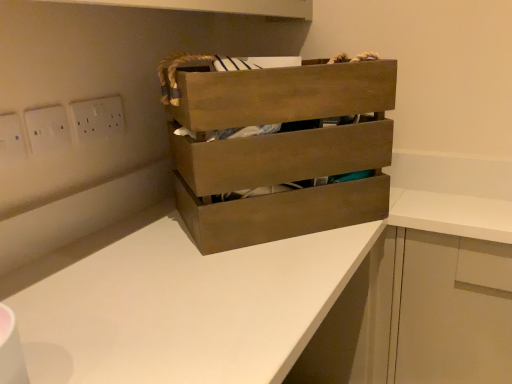
What do you see at coordinates (450, 293) in the screenshot? I see `white matte cabinet at lower right` at bounding box center [450, 293].

This screenshot has height=384, width=512. Describe the element at coordinates (97, 118) in the screenshot. I see `white plastic electric outlet at upper left, which ranks as the third electric outlet in front-to-back order` at that location.

Locate an element on the screen. Image resolution: width=512 pixels, height=384 pixels. white plastic switch at upper left, which appears as the second electric outlet when viewed from the front is located at coordinates (47, 129).

Find the location of a particular element. The height and width of the screenshot is (384, 512). electric outlet that is the 2nd one when counting upward from the white matte cabinet at lower right (from the image's perspective) is located at coordinates (47, 129).

Which object is positioned more to the right, white matte cabinet at lower right or white plastic switch at upper left, the 2th electric outlet in the left-to-right sequence?

white matte cabinet at lower right.

From the image's perspective, who appears lower, white matte cabinet at lower right or white plastic switch at upper left, the 2th electric outlet in the left-to-right sequence?

white matte cabinet at lower right is shown below in the image.

From a real-world perspective, is white matte cabinet at lower right physically below white plastic switch at upper left, the 2th electric outlet in the left-to-right sequence?

Yes.

Who is smaller, white matte counter at center or white matte cabinet at lower right?

white matte cabinet at lower right is smaller.

Looking at their sizes, would you say white matte counter at center is wider or thinner than white matte cabinet at lower right?

white matte counter at center is wider than white matte cabinet at lower right.

Is white matte counter at center oriented away from white matte cabinet at lower right?

No, white matte cabinet at lower right is not at the back of white matte counter at center.

From a real-world perspective, between white matte counter at center and white matte cabinet at lower right, who is vertically higher?

From a 3D spatial view, white matte cabinet at lower right is above.

Can you see white matte counter at center touching white plastic electric outlet at upper left, the first electric outlet in the front-to-back sequence?

No, white matte counter at center is not beside white plastic electric outlet at upper left, the first electric outlet in the front-to-back sequence.

Who is more distant, white matte counter at center or white plastic electric outlet at upper left, the first electric outlet in the front-to-back sequence?

Positioned behind is white plastic electric outlet at upper left, the first electric outlet in the front-to-back sequence.

Where is `electric outlet that is the 1st object above the white matte counter at center (from a real-world perspective)`? electric outlet that is the 1st object above the white matte counter at center (from a real-world perspective) is located at coordinates (11, 138).

How much distance is there between white matte counter at center and white plastic electric outlet at upper left, which is the third electric outlet in back-to-front order?

white matte counter at center and white plastic electric outlet at upper left, which is the third electric outlet in back-to-front order, are 25.87 inches apart.

Does white matte counter at center have a greater height compared to white plastic electric outlet at upper left, the first electric outlet viewed from the right?

Correct, white matte counter at center is much taller as white plastic electric outlet at upper left, the first electric outlet viewed from the right.

Which is behind, point (181, 316) or point (95, 124)?

Point (95, 124)

The height and width of the screenshot is (384, 512). Identify the location of counter on the right of the white plastic electric outlet at upper left, the first electric outlet viewed from the right. (265, 298).

From a real-world perspective, which electric outlet is the 3rd one above the white matte cabinet at lower right? Please provide its 2D coordinates.

[(97, 118)]

Is white plastic electric outlet at upper left, placed as the third electric outlet when sorted from left to right, not within white matte cabinet at lower right?

Yes, white plastic electric outlet at upper left, placed as the third electric outlet when sorted from left to right, is located beyond the bounds of white matte cabinet at lower right.

Is white plastic electric outlet at upper left, placed as the third electric outlet when sorted from left to right, looking in the opposite direction of white matte cabinet at lower right?

white plastic electric outlet at upper left, placed as the third electric outlet when sorted from left to right, is not turned away from white matte cabinet at lower right.

Can you confirm if white plastic electric outlet at upper left, acting as the first electric outlet starting from the back, is positioned to the right of white matte cabinet at lower right?

In fact, white plastic electric outlet at upper left, acting as the first electric outlet starting from the back, is to the left of white matte cabinet at lower right.

Is white plastic switch at upper left, which appears as the second electric outlet when viewed from the front, to the left or to the right of white plastic electric outlet at upper left, placed as the third electric outlet when sorted from left to right, in the image?

In the image, white plastic switch at upper left, which appears as the second electric outlet when viewed from the front, appears on the left side of white plastic electric outlet at upper left, placed as the third electric outlet when sorted from left to right.

Which object is thinner, white plastic switch at upper left, the 2th electric outlet in the left-to-right sequence, or white plastic electric outlet at upper left, which ranks as the third electric outlet in front-to-back order?

Thinner between the two is white plastic electric outlet at upper left, which ranks as the third electric outlet in front-to-back order.

From the picture: From a real-world perspective, which object rests below the other?

white plastic switch at upper left, the second electric outlet when ordered from right to left, from a real-world perspective.

Locate an element on the screen. The width and height of the screenshot is (512, 384). the 1st electric outlet to the left when counting from the white plastic electric outlet at upper left, which ranks as the third electric outlet in front-to-back order is located at coordinates (47, 129).

From the picture: From a real-world perspective, is white matte counter at center on top of wooden crate at center?

No, from a real-world perspective, white matte counter at center is not above wooden crate at center.

Can you confirm if white matte counter at center is shorter than wooden crate at center?

No.

Is white matte counter at center spatially inside wooden crate at center, or outside of it?

white matte counter at center cannot be found inside wooden crate at center.

Which object is further away from the camera taking this photo, white matte counter at center or wooden crate at center?

wooden crate at center is further away from the camera.

The image size is (512, 384). In the image, there is a white plastic switch at upper left, the 2th electric outlet in the left-to-right sequence. Find the location of `cabinetry below it (from the image's perspective)`. cabinetry below it (from the image's perspective) is located at coordinates (450, 293).

You are a GUI agent. You are given a task and a screenshot of the screen. Output one action in this format:
    pyautogui.click(x=<x>, y=<y>)
    Task: Click on the cabinetry above the white matte counter at center (from the image's perspective)
    The height and width of the screenshot is (384, 512).
    Given the screenshot: What is the action you would take?
    pyautogui.click(x=450, y=293)

Looking at the image, which one is located further to white plastic electric outlet at upper left, which ranks as the third electric outlet in front-to-back order, white plastic electric outlet at upper left, which is the third electric outlet in back-to-front order, or white matte cabinet at lower right?

white matte cabinet at lower right.

Considering their positions, is white plastic electric outlet at upper left, marked as the third electric outlet in a right-to-left arrangement, positioned closer to wooden crate at center than white matte cabinet at lower right?

white matte cabinet at lower right is positioned closer to the anchor wooden crate at center.

Based on their spatial positions, is white matte cabinet at lower right or white plastic electric outlet at upper left, the first electric outlet viewed from the right, further from white plastic electric outlet at upper left, which is the third electric outlet in back-to-front order?

white matte cabinet at lower right is positioned further to the anchor white plastic electric outlet at upper left, which is the third electric outlet in back-to-front order.

Looking at the image, which one is located further to white matte cabinet at lower right, wooden crate at center or white plastic electric outlet at upper left, acting as the first electric outlet starting from the back?

white plastic electric outlet at upper left, acting as the first electric outlet starting from the back.

Estimate the real-world distances between objects in this image. Which object is closer to white matte counter at center, wooden crate at center or white plastic electric outlet at upper left, which is the third electric outlet in back-to-front order?

Among the two, wooden crate at center is located nearer to white matte counter at center.

Looking at the image, which one is located closer to white matte counter at center, white plastic electric outlet at upper left, the first electric outlet in the front-to-back sequence, or white plastic electric outlet at upper left, placed as the third electric outlet when sorted from left to right?

Among the two, white plastic electric outlet at upper left, placed as the third electric outlet when sorted from left to right, is located nearer to white matte counter at center.

When comparing their distances from wooden crate at center, does white plastic electric outlet at upper left, marked as the third electric outlet in a right-to-left arrangement, or white matte counter at center seem further?

Based on the image, white plastic electric outlet at upper left, marked as the third electric outlet in a right-to-left arrangement, appears to be further to wooden crate at center.

Looking at the image, which one is located closer to white matte cabinet at lower right, white plastic electric outlet at upper left, which is the third electric outlet in back-to-front order, or white matte counter at center?

white matte counter at center lies closer to white matte cabinet at lower right than the other object.

Identify the location of counter situated between white plastic electric outlet at upper left, the first electric outlet from the left, and white matte cabinet at lower right from left to right. Image resolution: width=512 pixels, height=384 pixels. (265, 298).

You are a GUI agent. You are given a task and a screenshot of the screen. Output one action in this format:
    pyautogui.click(x=<x>, y=<y>)
    Task: Click on the electric outlet situated between white plastic switch at upper left, the 2th electric outlet in the left-to-right sequence, and wooden crate at center from left to right
    The height and width of the screenshot is (384, 512).
    Given the screenshot: What is the action you would take?
    pyautogui.click(x=97, y=118)

The width and height of the screenshot is (512, 384). I want to click on electric outlet between white plastic switch at upper left, the second electric outlet when ordered from right to left, and white matte cabinet at lower right, so click(x=97, y=118).

At what (x,y) coordinates should I click in order to perform the action: click on chest of drawers between white plastic switch at upper left, the second electric outlet when ordered from right to left, and white matte counter at center in the up-down direction. Please return your answer as a coordinate pair (x, y). Looking at the image, I should click on (282, 151).